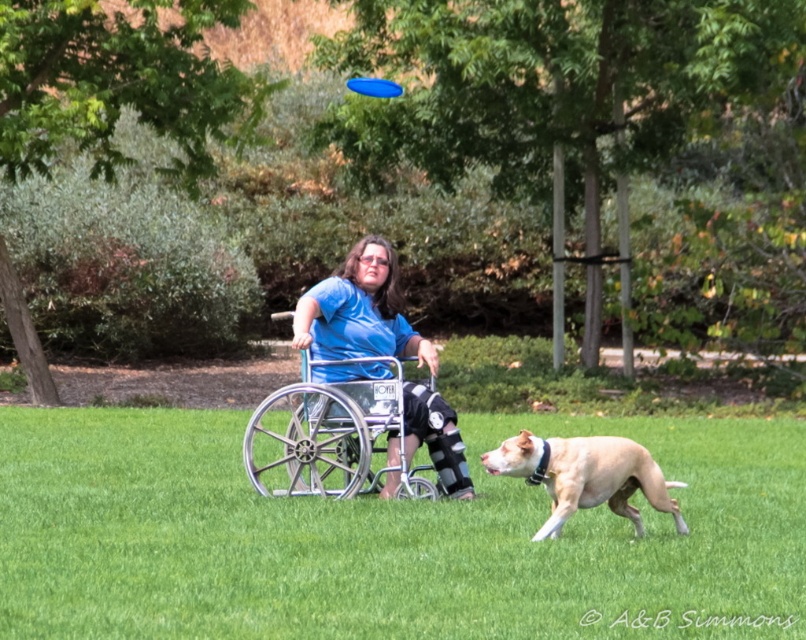
Question: Which object is closer to the camera taking this photo?

Choices:
 (A) blue plastic frisbee at upper center
 (B) green grass at center

Answer: (B)

Question: Is green grass at center to the left of blue plastic frisbee at upper center from the viewer's perspective?

Choices:
 (A) yes
 (B) no

Answer: (B)

Question: Does silver metallic wheelchair at center lie behind tan smooth fur at center?

Choices:
 (A) no
 (B) yes

Answer: (B)

Question: Does green grass at center appear on the right side of blue plastic frisbee at upper center?

Choices:
 (A) no
 (B) yes

Answer: (B)

Question: Which of these objects is positioned closest to the blue plastic frisbee at upper center?

Choices:
 (A) tan smooth fur at center
 (B) green grass at center
 (C) silver metallic wheelchair at center

Answer: (B)

Question: Which point appears closest to the camera in this image?

Choices:
 (A) (692, 636)
 (B) (393, 93)
 (C) (266, 496)

Answer: (A)